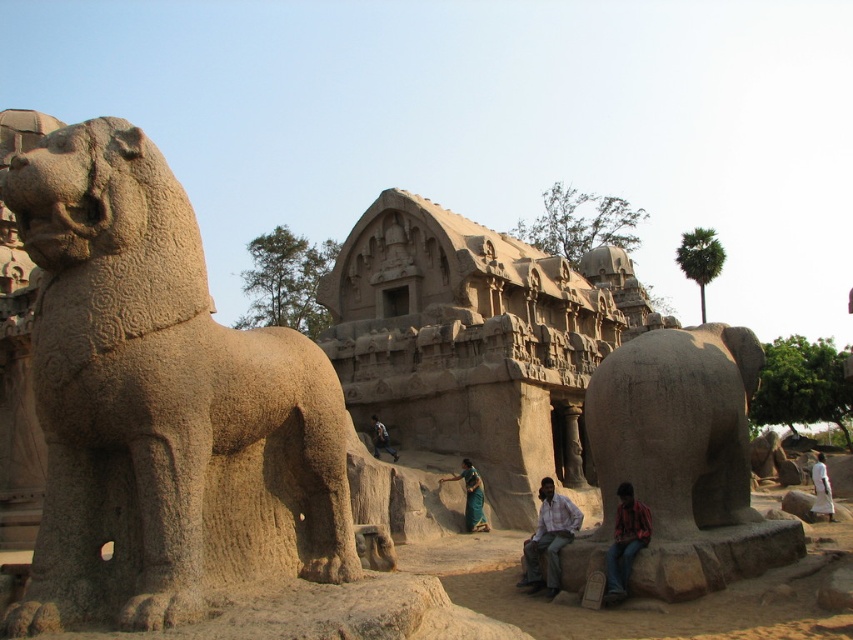
Question: Observing the image, what is the correct spatial positioning of gray stone elephant at right in reference to red plaid shirt at lower right?

Choices:
 (A) below
 (B) above

Answer: (B)

Question: Does green silk saree at center appear over white cotton dress at center?

Choices:
 (A) yes
 (B) no

Answer: (A)

Question: Does gray stone elephant at right have a lesser width compared to light brown stone statue at center?

Choices:
 (A) no
 (B) yes

Answer: (A)

Question: Which point is farther to the camera?

Choices:
 (A) gray stone lion at left
 (B) light brown stone statue at center

Answer: (B)

Question: Which of the following is the closest to the observer?

Choices:
 (A) light brown stone statue at center
 (B) red plaid shirt at lower right

Answer: (B)

Question: Which point is closer to the camera taking this photo?

Choices:
 (A) (383, 448)
 (B) (538, 522)
 (C) (819, 506)
 (D) (691, 429)

Answer: (D)